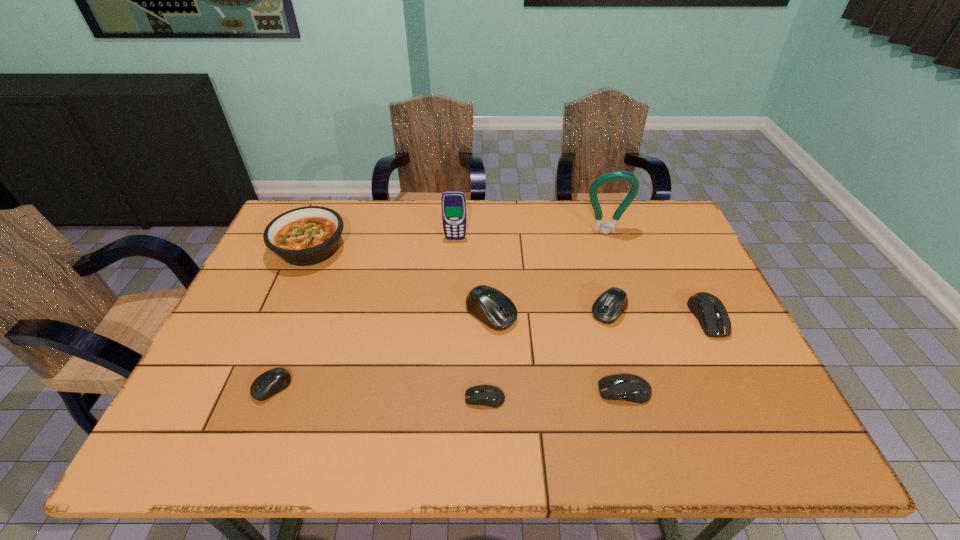
This screenshot has width=960, height=540. I want to click on free space at the far right corner, so click(665, 242).

Where is `free space that is in between the tallest computer equipment and the leftmost dark computer equipment`? The height and width of the screenshot is (540, 960). free space that is in between the tallest computer equipment and the leftmost dark computer equipment is located at coordinates pos(488,356).

In order to click on vacant space in between the rightmost object and the third tallest object in this screenshot , I will do `click(509, 283)`.

Where is `unoccupied area between the shortest object and the rightmost dark computer equipment`? Image resolution: width=960 pixels, height=540 pixels. unoccupied area between the shortest object and the rightmost dark computer equipment is located at coordinates (596, 357).

Where is `empty space that is in between the tallest object and the cellular telephone`? Image resolution: width=960 pixels, height=540 pixels. empty space that is in between the tallest object and the cellular telephone is located at coordinates (530, 235).

Identify the location of free area in between the second smallest black mouse and the leftmost dark computer equipment. The image size is (960, 540). (547, 354).

Where is `free space between the leftmost computer equipment and the second smallest black mouse`? The width and height of the screenshot is (960, 540). free space between the leftmost computer equipment and the second smallest black mouse is located at coordinates (441, 349).

This screenshot has height=540, width=960. In order to click on free space between the leftmost black mouse and the stew in this screenshot , I will do `click(292, 318)`.

I want to click on vacant space in between the green bottle opener and the leftmost dark computer equipment, so click(x=545, y=315).

Locate an element on the screen. vacant area that lies between the third object from left to right and the fourth tallest object is located at coordinates (473, 276).